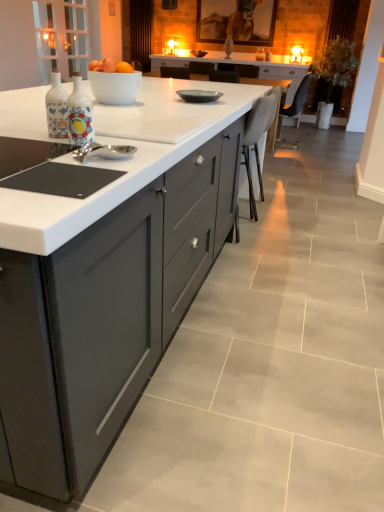
Question: Is white leather chair at center, which is the first chair from left to right, in front of or behind white glossy bowl at center in the image?

Choices:
 (A) front
 (B) behind

Answer: (B)

Question: Is white leather chair at center, the 1th chair in the front-to-back sequence, wider or thinner than white glossy bowl at center?

Choices:
 (A) thin
 (B) wide

Answer: (B)

Question: Which of these objects is positioned farthest from the matte gray cabinetry at center?

Choices:
 (A) white leather chair at center, the second chair viewed from the top
 (B) decorative ceramic bottle at center-left
 (C) matte gray plate at center
 (D) white glossy bowl at center
 (E) dark brown leather chair at upper right, acting as the 1th chair starting from the right

Answer: (E)

Question: Estimate the real-world distances between objects in this image. Which object is closer to the matte gray plate at center?

Choices:
 (A) matte gray cabinetry at center
 (B) white leather chair at center, the 2th chair from the right
 (C) white glossy bowl at center
 (D) dark brown leather chair at upper right, arranged as the 1th chair when viewed from the top
 (E) decorative ceramic bottle at center-left

Answer: (C)